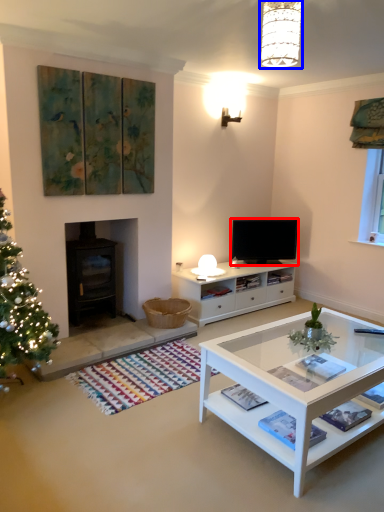
Question: Which point is closer to the camera, television (highlighted by a red box) or lamp (highlighted by a blue box)?

Choices:
 (A) television
 (B) lamp

Answer: (B)